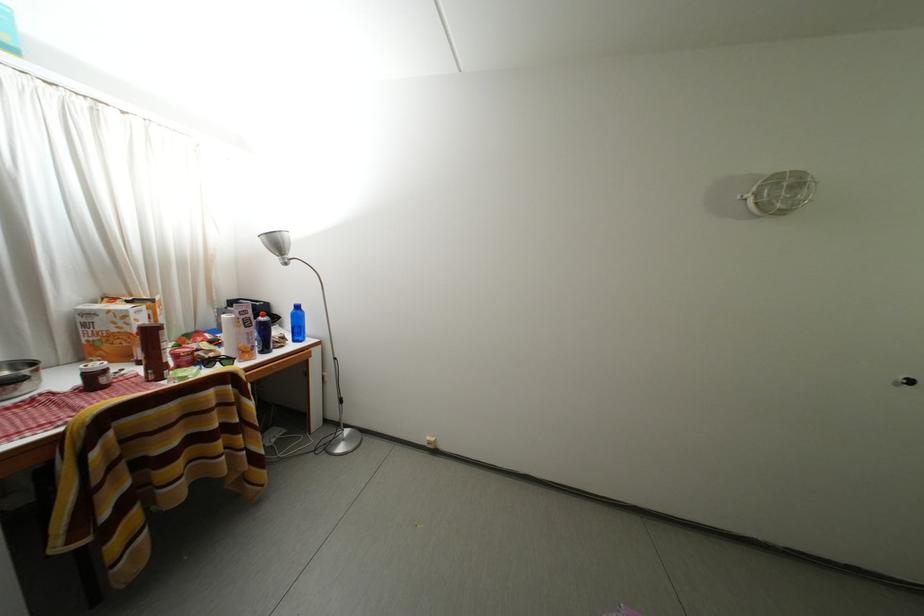
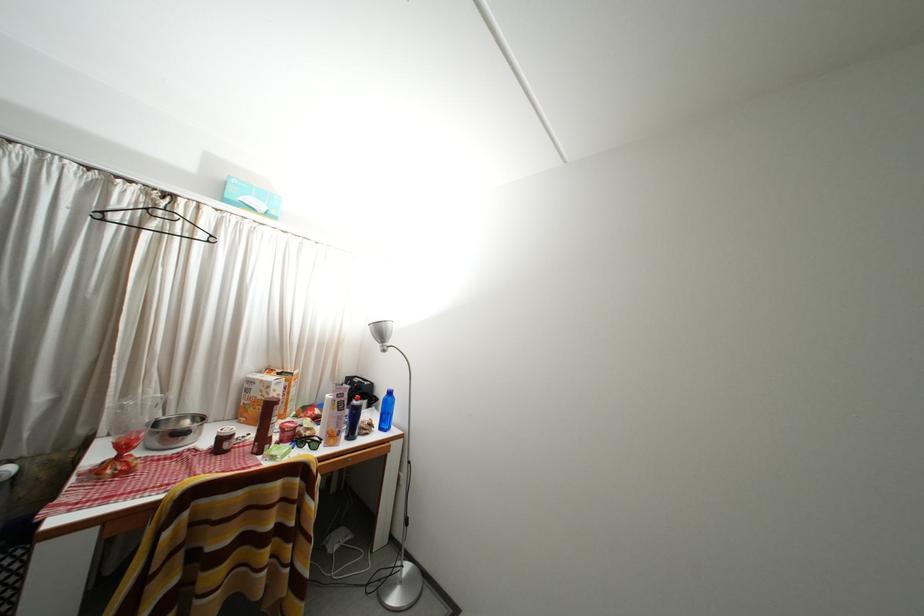
Find the pixel in the second image that matches [297,341] in the first image.

(383, 428)